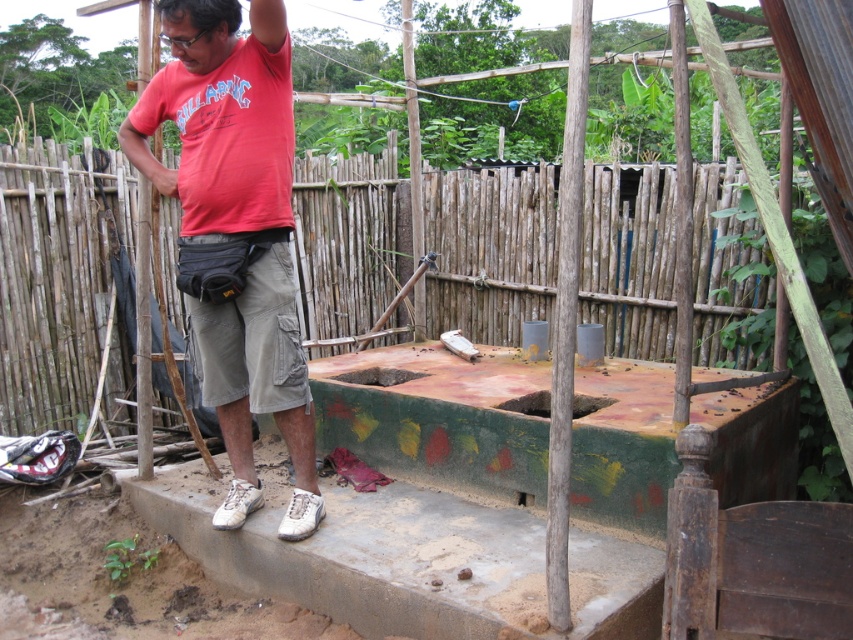
Can you confirm if weathered wood pole at center is taller than brown rough wooden pole at center?

Yes, weathered wood pole at center is taller than brown rough wooden pole at center.

Which is more to the right, weathered wood pole at center or brown rough wooden pole at center?

Positioned to the right is brown rough wooden pole at center.

Is point (569, 100) closer to viewer compared to point (682, 324)?

Yes, point (569, 100) is closer to viewer.

You are a GUI agent. You are given a task and a screenshot of the screen. Output one action in this format:
    pyautogui.click(x=<x>, y=<y>)
    Task: Click on the weathered wood pole at center
    
    Given the screenshot: What is the action you would take?
    pyautogui.click(x=566, y=317)

Consider the image. Who is more forward, (196, 128) or (682, 60)?

Point (682, 60)

Between point (233, 492) and point (677, 6), which one is positioned behind?

The point (233, 492) is behind.

Locate an element on the screen. white matte sneakers at lower center is located at coordinates [x=236, y=228].

Is the position of green painted concrete foundation at center more distant than that of weathered wood pole at center?

Yes.

Does green painted concrete foundation at center appear on the right side of weathered wood pole at center?

In fact, green painted concrete foundation at center is to the left of weathered wood pole at center.

What do you see at coordinates (368, 554) in the screenshot?
I see `green painted concrete foundation at center` at bounding box center [368, 554].

At what (x,y) coordinates should I click in order to perform the action: click on green painted concrete foundation at center. Please return your answer as a coordinate pair (x, y). The image size is (853, 640). Looking at the image, I should click on (368, 554).